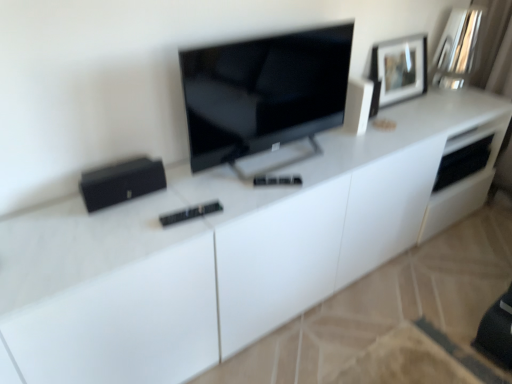
Locate an element on the screen. free spot to the left of white glossy speaker at upper right, the 2th appliance from the left is located at coordinates (325, 141).